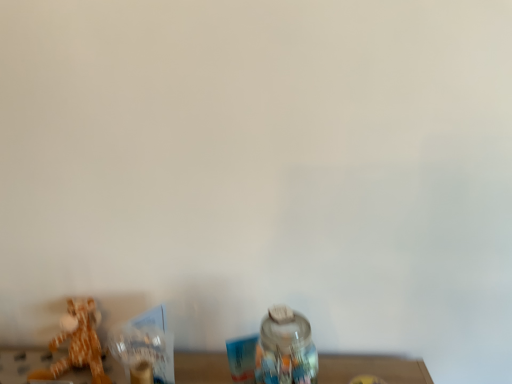
The height and width of the screenshot is (384, 512). Describe the element at coordinates (77, 343) in the screenshot. I see `soft plush giraffe at lower left` at that location.

In order to face soft plush giraffe at lower left, should I rotate leftwards or rightwards?

Turn left approximately 22.761 degrees to face it.

Locate an element on the screen. Image resolution: width=512 pixels, height=384 pixels. soft plush giraffe at lower left is located at coordinates (77, 343).

Find the location of a particular element. The width and height of the screenshot is (512, 384). soft plush giraffe at lower left is located at coordinates (77, 343).